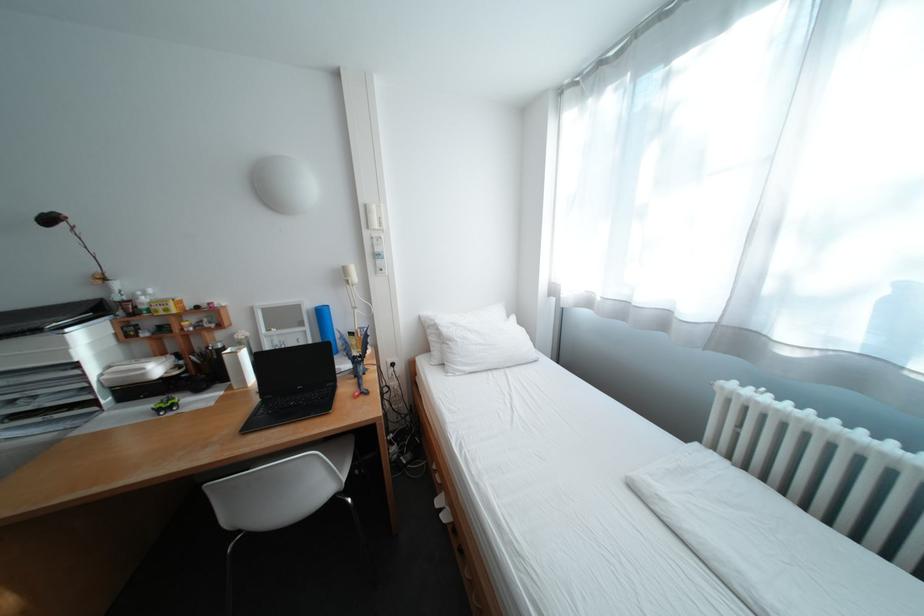
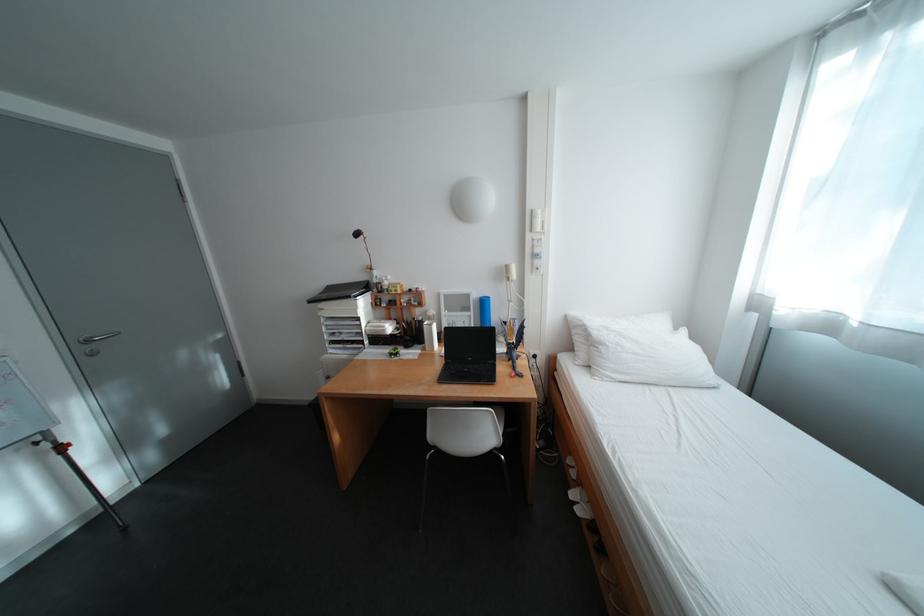
Where in the second image is the point corresponding to point (379, 207) from the first image?

(544, 213)